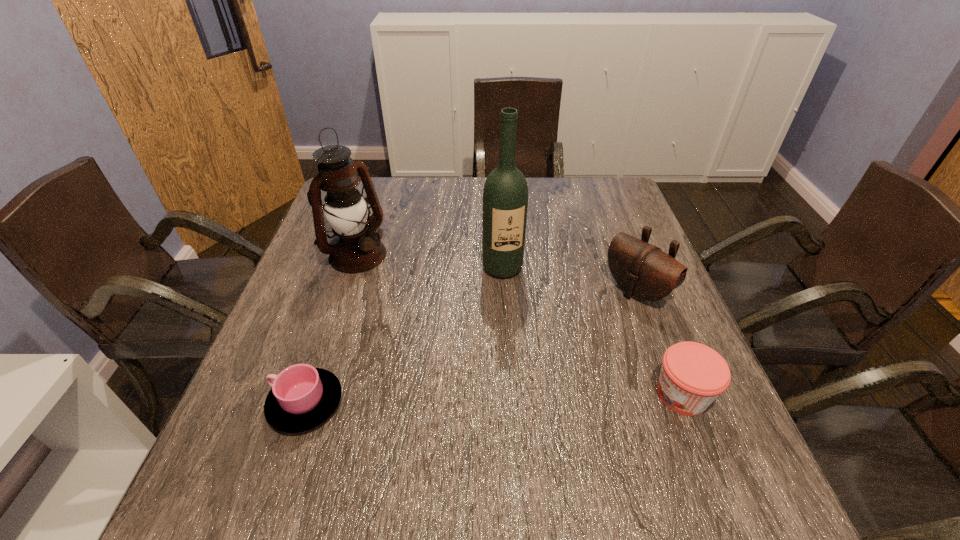
Point out which object is positioned as the second nearest to the fourth shortest object. Please provide its 2D coordinates. Your answer should be formatted as a tuple, i.e. [(x, y)], where the tuple contains the x and y coordinates of a point satisfying the conditions above.

[(302, 397)]

This screenshot has height=540, width=960. I want to click on object that stands as the closest to the lantern, so click(505, 196).

Where is `vacant position in the image that satisfies the following two spatial constraints: 1. on the front side of the pouch; 2. on the front label of the jam`? vacant position in the image that satisfies the following two spatial constraints: 1. on the front side of the pouch; 2. on the front label of the jam is located at coordinates (676, 395).